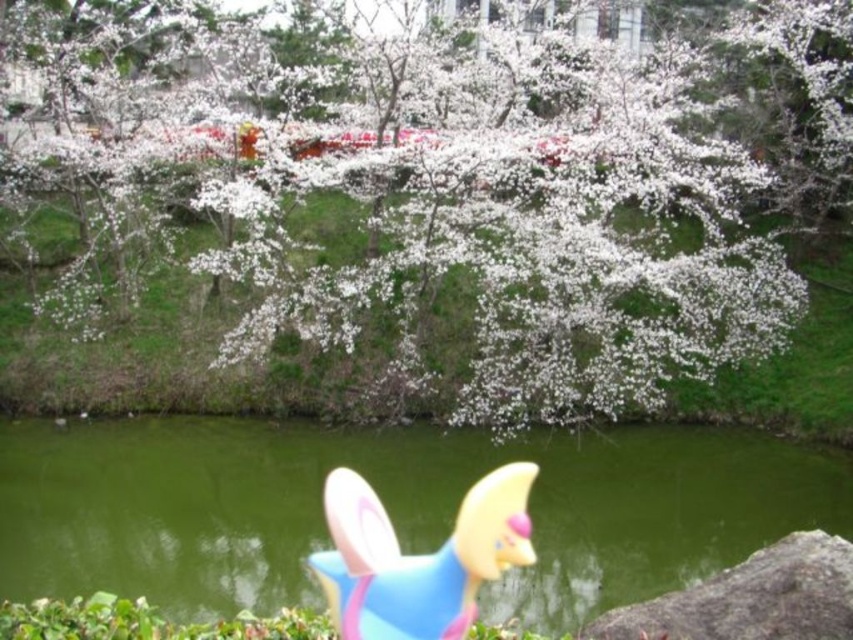
What do you see at coordinates (390, 508) in the screenshot? Image resolution: width=853 pixels, height=640 pixels. I see `green glossy water at lower center` at bounding box center [390, 508].

Is point (228, 540) farther from viewer compared to point (715, 634)?

That is True.

The height and width of the screenshot is (640, 853). I want to click on green glossy water at lower center, so click(390, 508).

Measure the distance between white matte tree at upper center and green glossy water at lower center.

The distance of white matte tree at upper center from green glossy water at lower center is 3.69 meters.

Who is more forward, (787, 196) or (733, 541)?

Point (733, 541)

Between point (419, 369) and point (126, 552), which one is positioned behind?

The point (419, 369) is more distant.

Find the location of a particular element. white matte tree at upper center is located at coordinates (465, 234).

Can you confirm if white matte tree at upper center is positioned to the right of blue rubber toy at lower center?

Incorrect, white matte tree at upper center is not on the right side of blue rubber toy at lower center.

Locate an element on the screen. The height and width of the screenshot is (640, 853). white matte tree at upper center is located at coordinates (x=465, y=234).